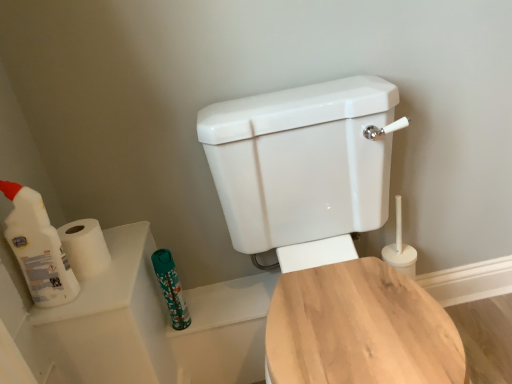
What are the coordinates of `vacant space to the right of white plastic bottle at left` in the screenshot? It's located at tap(109, 285).